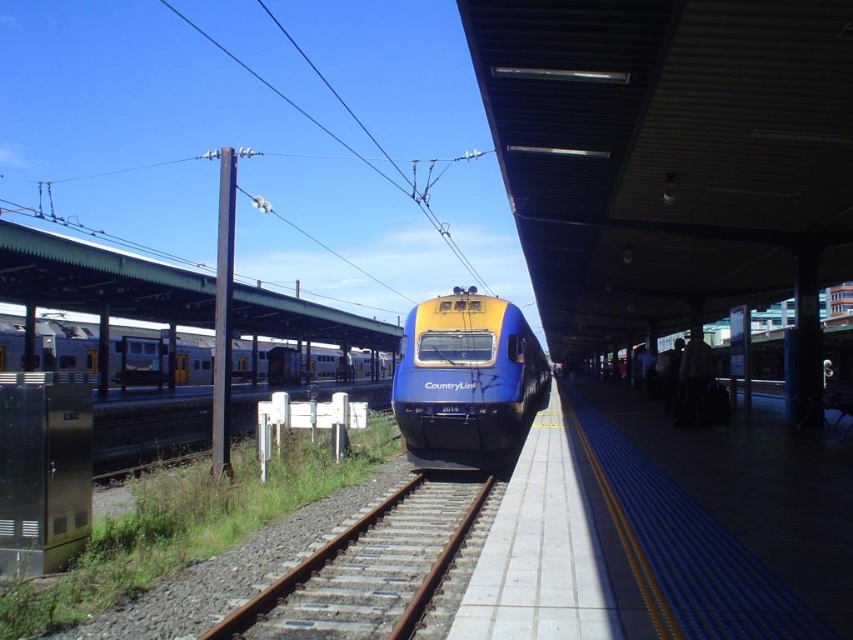
Question: Which object is farther from the camera taking this photo?

Choices:
 (A) rusty metal train track at center
 (B) blue glossy train at center
 (C) silver metallic train at left

Answer: (C)

Question: Is rusty metal train track at center further to camera compared to blue glossy train at center?

Choices:
 (A) no
 (B) yes

Answer: (A)

Question: Does rusty metal train track at center have a larger size compared to silver metallic train at left?

Choices:
 (A) yes
 (B) no

Answer: (B)

Question: Based on their relative distances, which object is farther from the blue glossy train at center?

Choices:
 (A) silver metallic train at left
 (B) rusty metal train track at center

Answer: (A)

Question: Can you confirm if rusty metal train track at center is positioned to the left of silver metallic train at left?

Choices:
 (A) no
 (B) yes

Answer: (A)

Question: Which of the following is the farthest from the observer?

Choices:
 (A) rusty metal train track at center
 (B) silver metallic train at left
 (C) blue glossy train at center

Answer: (B)